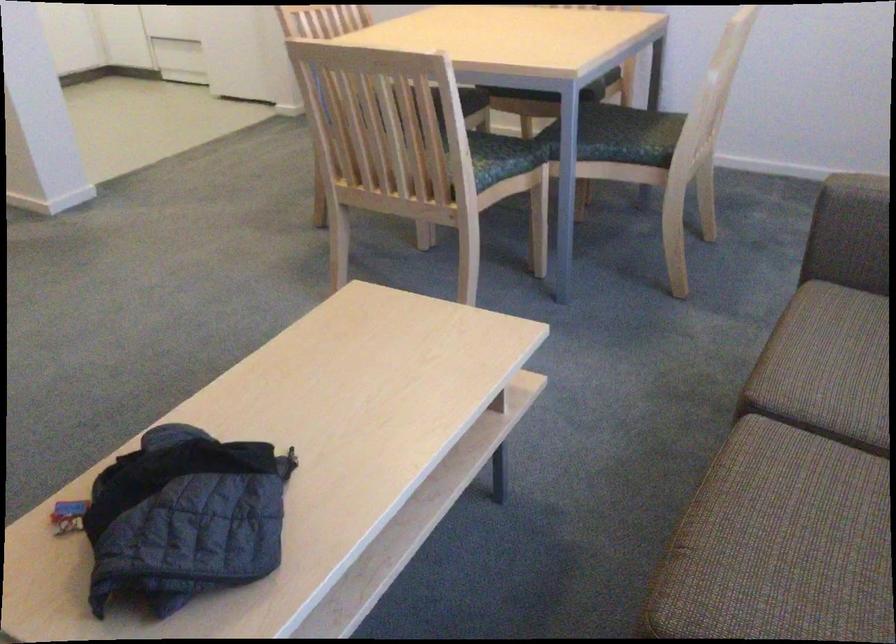
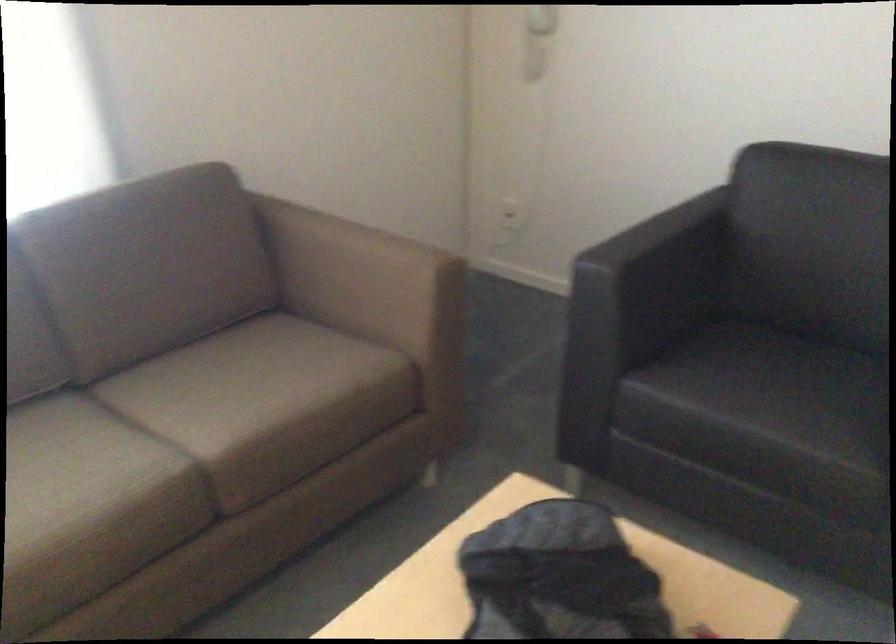
Where in the second image is the point corresponding to (x=225, y=469) from the first image?

(558, 576)